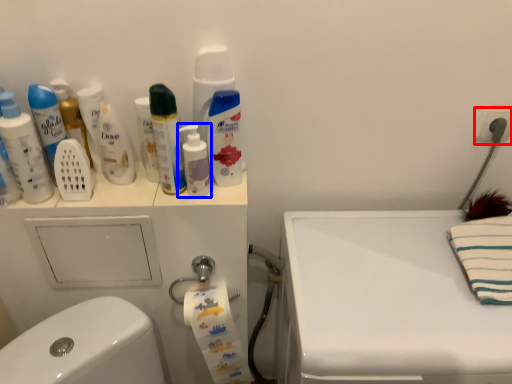
Question: Which object appears farthest to the camera in this image, electric outlet (highlighted by a red box) or mouthwash (highlighted by a blue box)?

Choices:
 (A) electric outlet
 (B) mouthwash

Answer: (A)